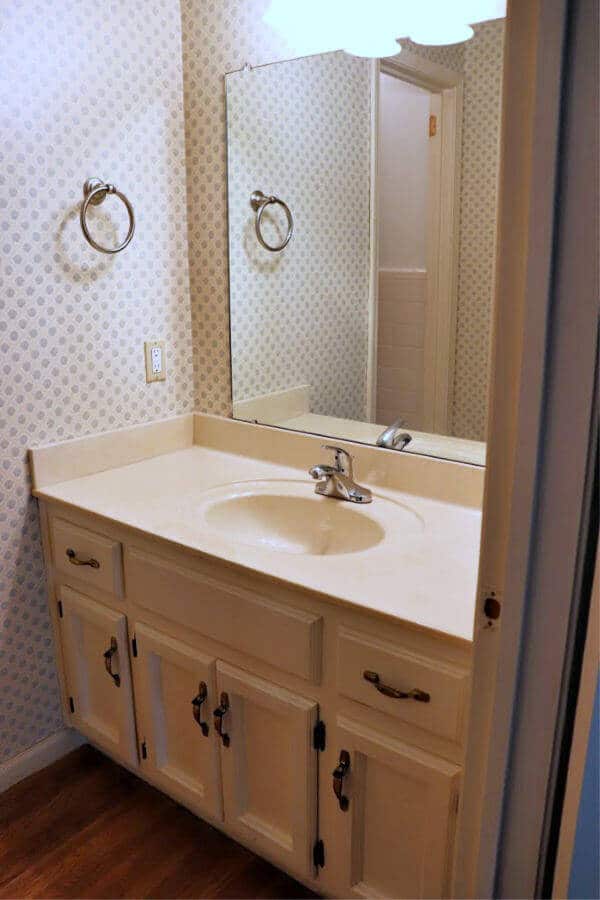
Find the location of a particular element. This screenshot has width=600, height=900. brown wood flooring is located at coordinates (156, 868).